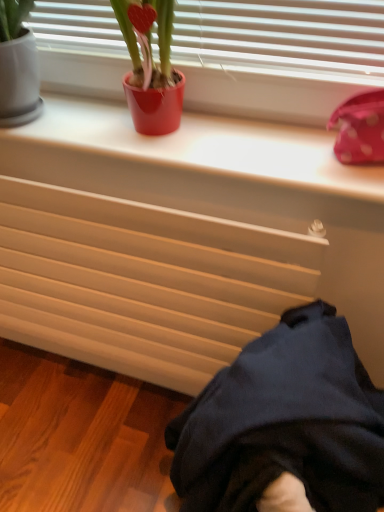
Where is `free space above white smooth window sill at upper center (from a real-world perspective)`? The height and width of the screenshot is (512, 384). free space above white smooth window sill at upper center (from a real-world perspective) is located at coordinates (183, 132).